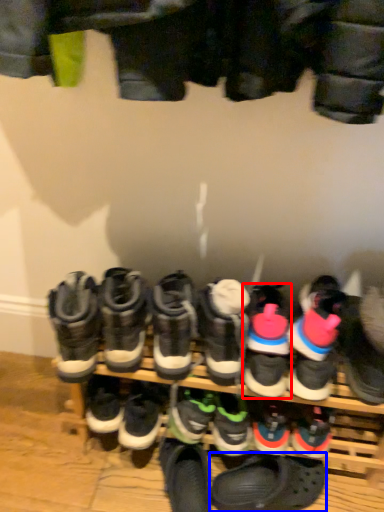
Question: Which object appears farthest to the camera in this image, footwear (highlighted by a red box) or footwear (highlighted by a blue box)?

Choices:
 (A) footwear
 (B) footwear

Answer: (B)